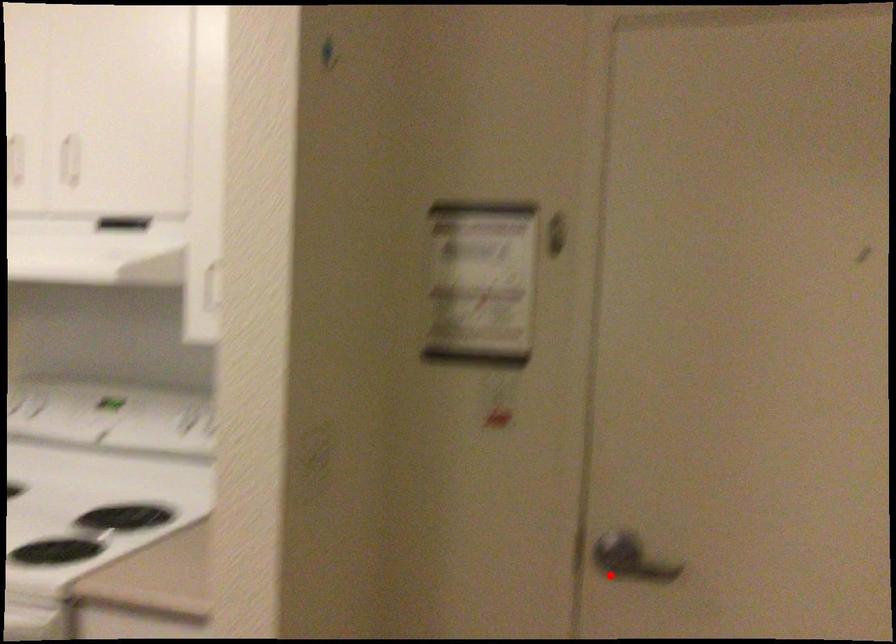
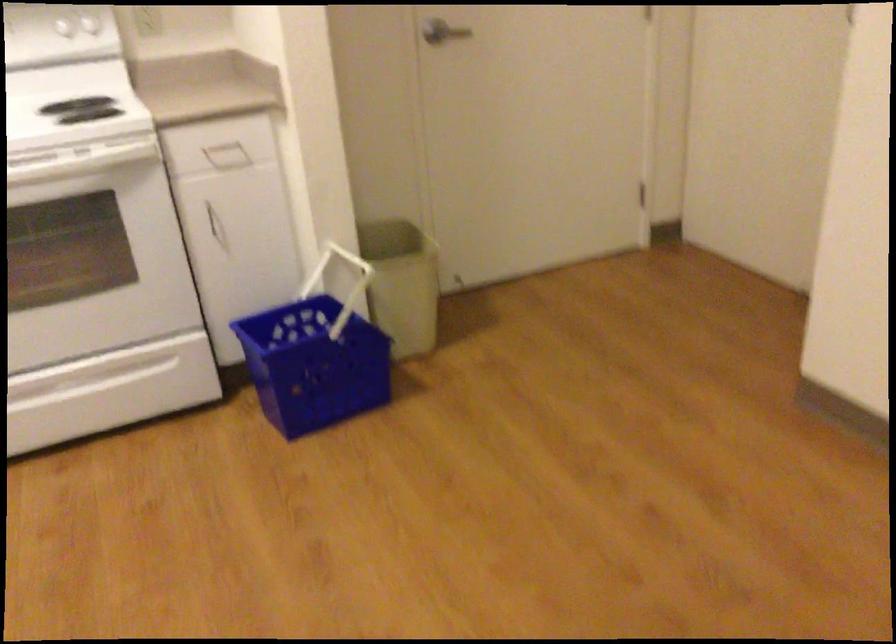
Question: I am providing you with two images of the same scene from different viewpoints. In image1, a red point is highlighted. Considering the same 3D point in image2, which of the following is correct?

Choices:
 (A) It is closer
 (B) It is farther

Answer: (B)